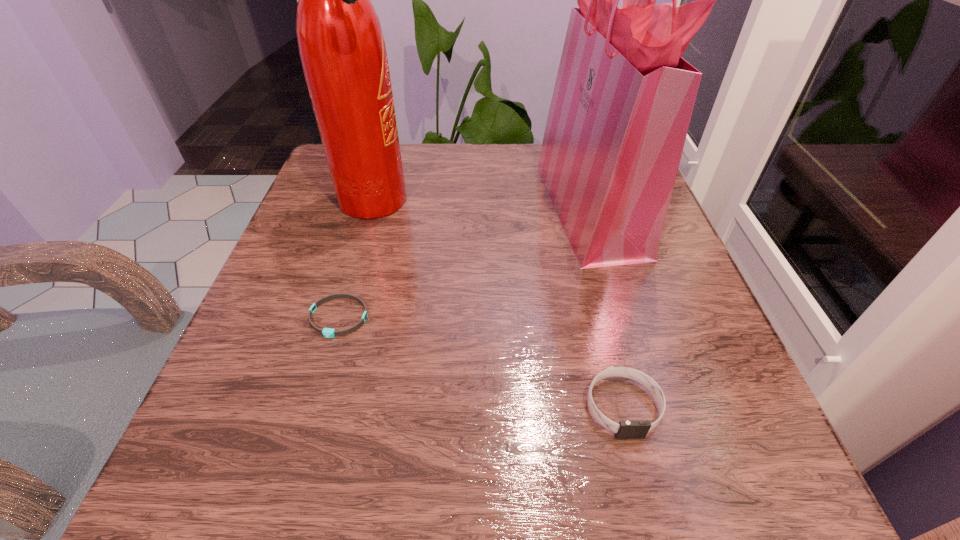
Find the location of `shopping bag present at the far edge`. shopping bag present at the far edge is located at coordinates (623, 99).

Where is `fire extinguisher that is at the far edge`? fire extinguisher that is at the far edge is located at coordinates (341, 45).

Find the location of a particular element. object that is at the near edge is located at coordinates [626, 429].

Locate an element on the screen. fire extinguisher that is at the left edge is located at coordinates (341, 45).

Locate an element on the screen. This screenshot has width=960, height=540. wristband present at the left edge is located at coordinates (327, 332).

Identify the location of shopping bag situated at the right edge. (623, 99).

Where is `wristband at the right edge`? wristband at the right edge is located at coordinates (626, 429).

Identify the location of object that is at the far left corner. (341, 45).

At what (x,y) coordinates should I click in order to perform the action: click on object positioned at the far right corner. Please return your answer as a coordinate pair (x, y). This screenshot has width=960, height=540. Looking at the image, I should click on (623, 99).

Locate an element on the screen. This screenshot has width=960, height=540. object at the near right corner is located at coordinates (626, 429).